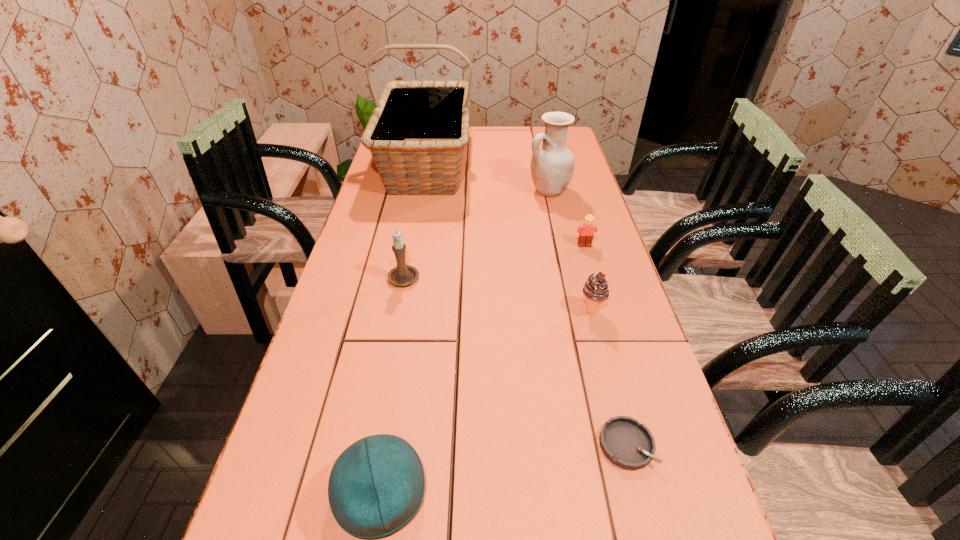
Locate an element on the screen. The image size is (960, 540). free region located on the side of the fourth farthest object with the handle is located at coordinates coord(417,209).

This screenshot has width=960, height=540. Find the location of `free space located on the side of the fourth farthest object with the handle`. free space located on the side of the fourth farthest object with the handle is located at coordinates (419, 199).

The image size is (960, 540). Identify the location of free space located on the side of the fourth farthest object with the handle. (417, 209).

You are a GUI agent. You are given a task and a screenshot of the screen. Output one action in this format:
    pyautogui.click(x=<x>, y=<y>)
    Task: Click on the free space located 0.050m on the front of the icecream
    The image size is (960, 540).
    Given the screenshot: What is the action you would take?
    pyautogui.click(x=598, y=336)

Where is `blank space located 0.050m on the face of the Lego`? Image resolution: width=960 pixels, height=540 pixels. blank space located 0.050m on the face of the Lego is located at coordinates (588, 259).

Where is `free space located 0.260m on the back of the shortest object`? This screenshot has width=960, height=540. free space located 0.260m on the back of the shortest object is located at coordinates (595, 325).

Find the location of a particular element. This screenshot has height=540, width=960. object at the far edge is located at coordinates coord(417,132).

You are a GUI agent. You are given a task and a screenshot of the screen. Output one action in this format:
    pyautogui.click(x=<x>, y=<y>)
    Task: Click on the basket positioned at the left edge
    
    Given the screenshot: What is the action you would take?
    pyautogui.click(x=417, y=132)

Where is `candle holder that is positioned at the left edge`? Image resolution: width=960 pixels, height=540 pixels. candle holder that is positioned at the left edge is located at coordinates (403, 275).

Identify the location of pottery that is at the right edge. The height and width of the screenshot is (540, 960). (552, 164).